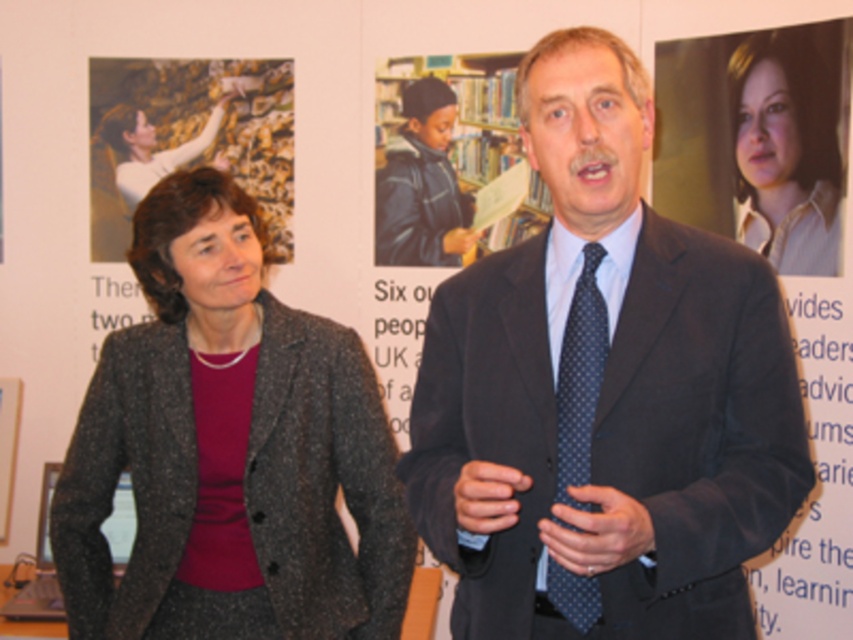
Does wooden bookshelf at center come in front of dark blue dotted tie at center?

No, wooden bookshelf at center is behind dark blue dotted tie at center.

Based on the photo, can you confirm if wooden bookshelf at center is smaller than dark blue dotted tie at center?

Incorrect, wooden bookshelf at center is not smaller in size than dark blue dotted tie at center.

Describe the element at coordinates (450, 161) in the screenshot. The height and width of the screenshot is (640, 853). I see `wooden bookshelf at center` at that location.

Identify the location of wooden bookshelf at center. (450, 161).

The width and height of the screenshot is (853, 640). What do you see at coordinates (229, 451) in the screenshot? I see `dark gray textured blazer at left` at bounding box center [229, 451].

Can you confirm if dark gray textured blazer at left is positioned below wooden bookshelf at center?

Yes.

The width and height of the screenshot is (853, 640). I want to click on dark gray textured blazer at left, so click(229, 451).

Does dark gray textured blazer at left appear on the right side of dark blue dotted tie at center?

Incorrect, dark gray textured blazer at left is not on the right side of dark blue dotted tie at center.

Is dark gray textured blazer at left bigger than dark blue dotted tie at center?

Yes, dark gray textured blazer at left is bigger than dark blue dotted tie at center.

The image size is (853, 640). I want to click on dark gray textured blazer at left, so click(x=229, y=451).